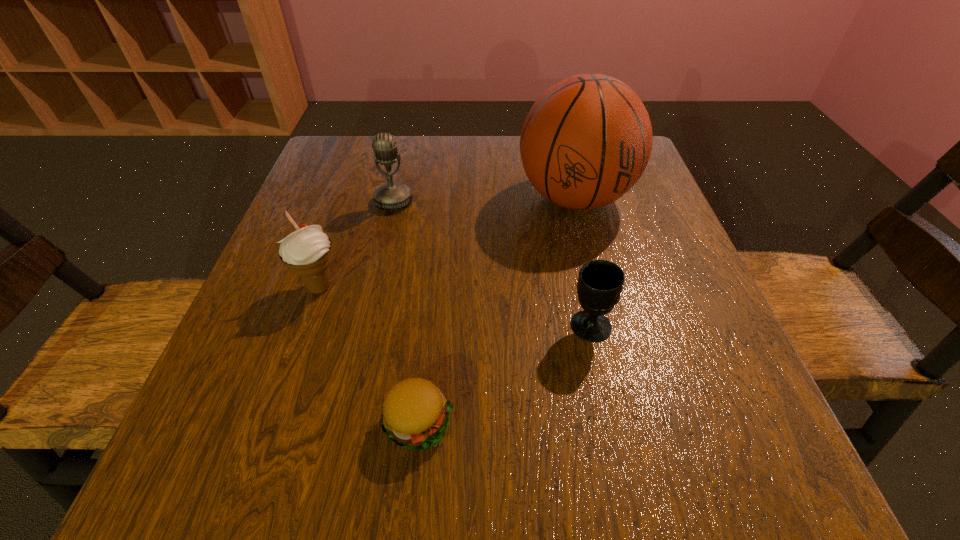
The width and height of the screenshot is (960, 540). Find the location of `free space that satisfies the following two spatial constraints: 1. on the back side of the basketball; 2. on the right side of the icecream`. free space that satisfies the following two spatial constraints: 1. on the back side of the basketball; 2. on the right side of the icecream is located at coordinates (350, 198).

Locate an element on the screen. vacant space that satisfies the following two spatial constraints: 1. on the front side of the fourth tallest object; 2. on the left side of the leftmost object is located at coordinates (306, 326).

Identify the location of free space that satisfies the following two spatial constraints: 1. on the front-facing side of the fourth object from right to left; 2. on the left side of the hamburger. The image size is (960, 540). (344, 422).

Where is `free spot that satisfies the following two spatial constraints: 1. on the back side of the chalice; 2. on the left side of the hamburger`? The width and height of the screenshot is (960, 540). free spot that satisfies the following two spatial constraints: 1. on the back side of the chalice; 2. on the left side of the hamburger is located at coordinates (427, 326).

Where is `vacant space that satisfies the following two spatial constraints: 1. on the front side of the fourth farthest object; 2. on the left side of the third farthest object`? This screenshot has height=540, width=960. vacant space that satisfies the following two spatial constraints: 1. on the front side of the fourth farthest object; 2. on the left side of the third farthest object is located at coordinates pyautogui.click(x=306, y=326).

At what (x,y) coordinates should I click in order to perform the action: click on vacant space that satisfies the following two spatial constraints: 1. on the back side of the chalice; 2. on the left side of the tallest object. Please return your answer as a coordinate pair (x, y). The image size is (960, 540). Looking at the image, I should click on pyautogui.click(x=562, y=198).